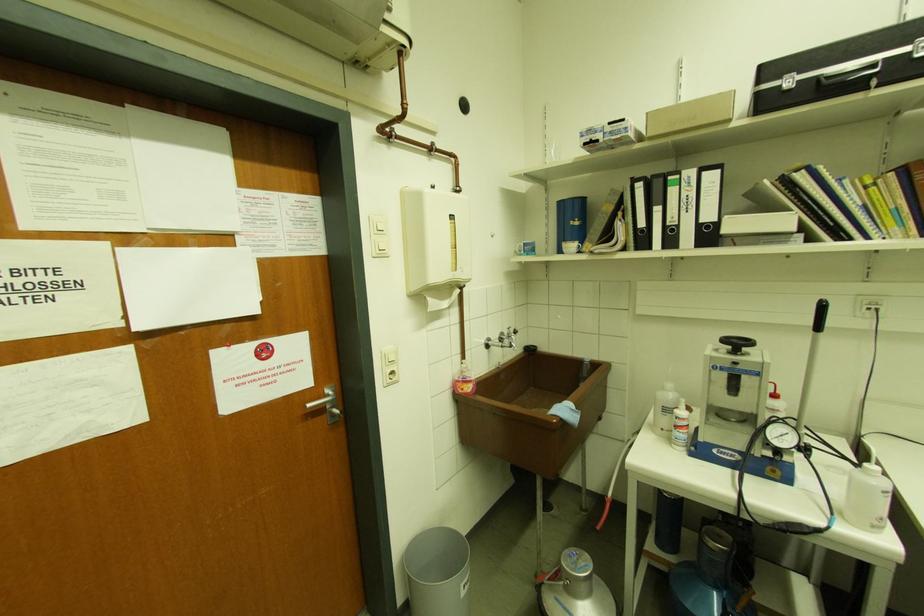
Locate an element on the screen. Image resolution: width=924 pixels, height=616 pixels. faucet handle is located at coordinates (507, 334).